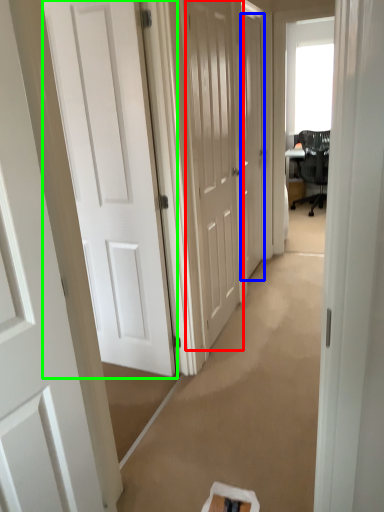
Question: Based on their relative distances, which object is farther from door (highlighted by a red box)? Choose from door (highlighted by a blue box) and door (highlighted by a green box).

Choices:
 (A) door
 (B) door

Answer: (A)